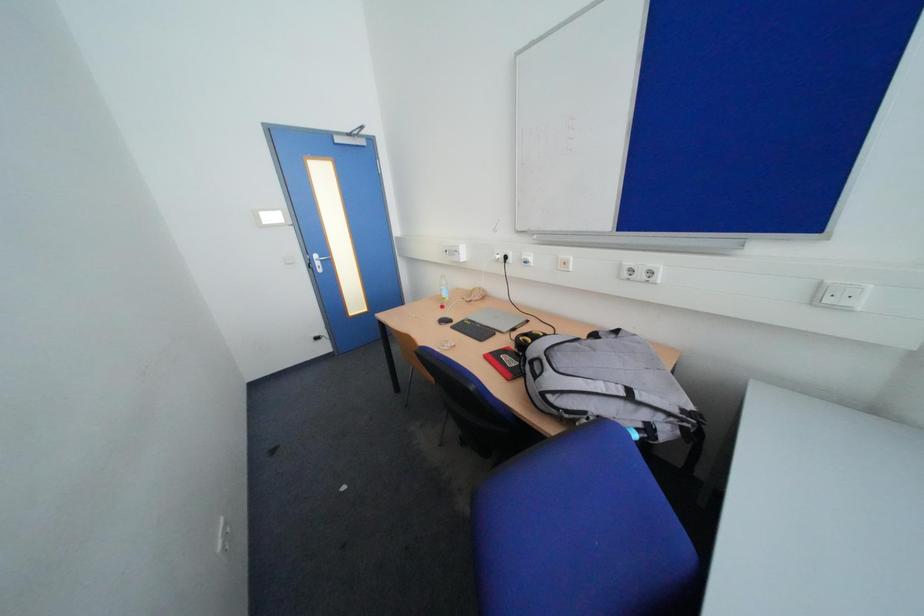
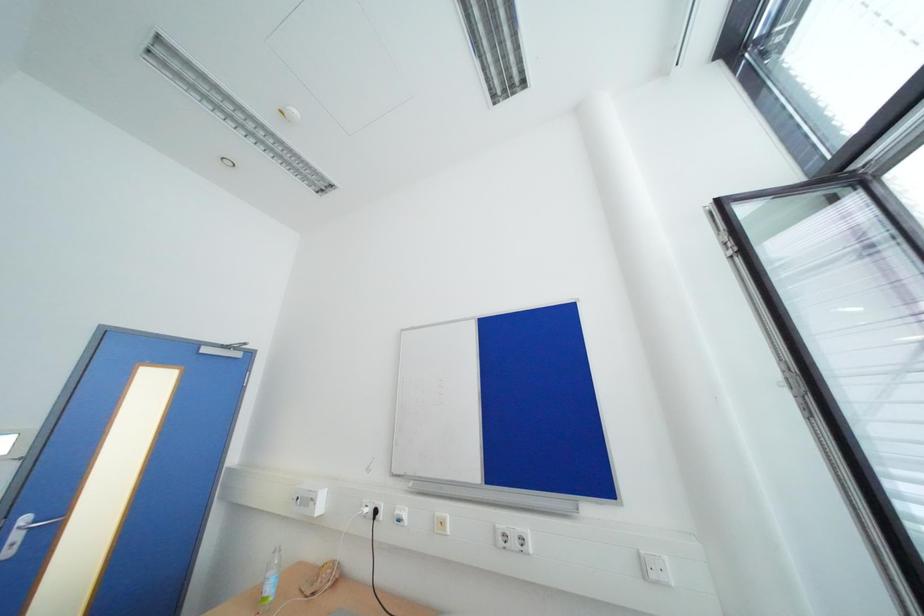
How did the camera likely rotate?

The rotation direction of the camera is right-up.